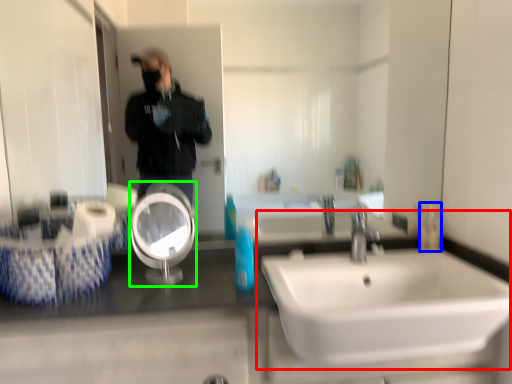
Question: Which is farther away from sink (highlighted by a red box)? mouthwash (highlighted by a blue box) or reflection (highlighted by a green box)?

Choices:
 (A) mouthwash
 (B) reflection

Answer: (B)